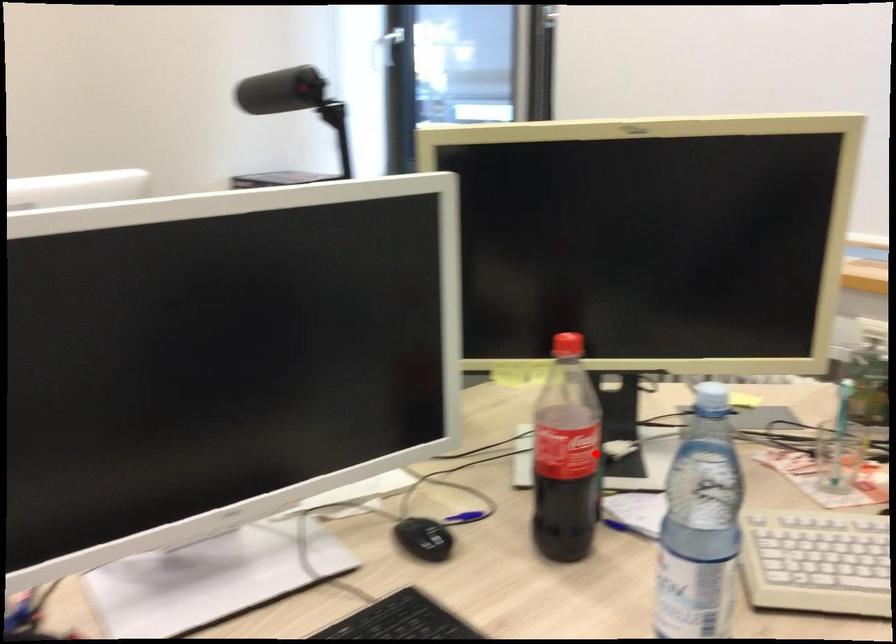
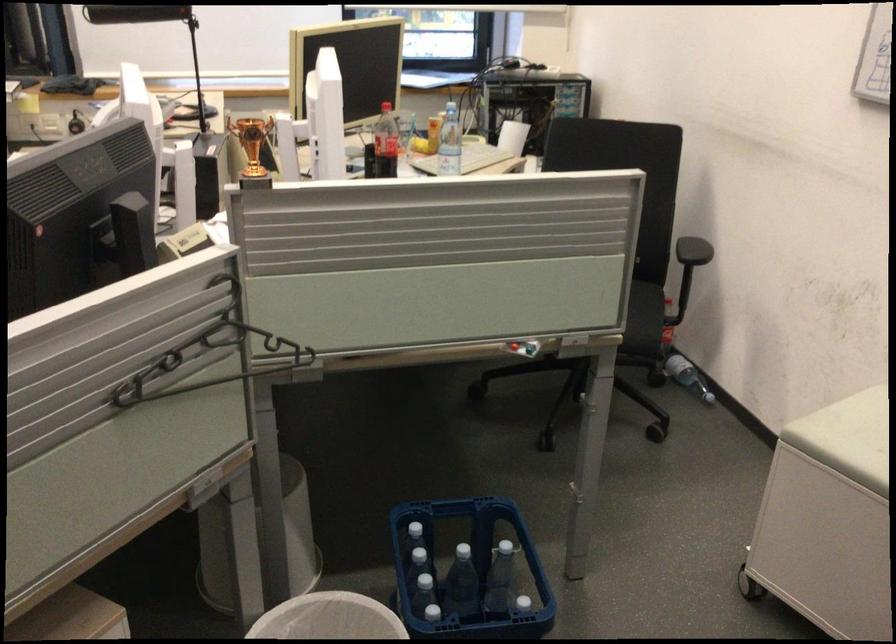
In the second image, find the point that corresponds to the highlighted location in the first image.

(385, 143)